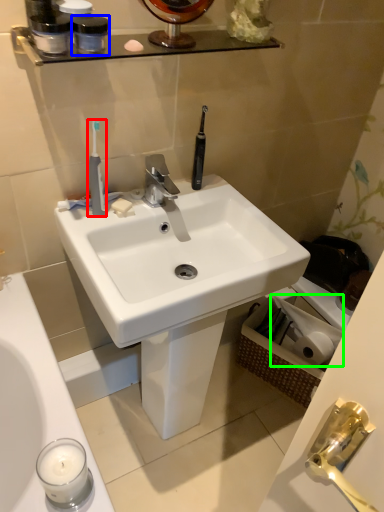
Question: Estimate the real-world distances between objects in this image. Which object is farther from toothbrush (highlighted by a red box), mouthwash (highlighted by a blue box) or toilet paper (highlighted by a green box)?

Choices:
 (A) mouthwash
 (B) toilet paper

Answer: (B)